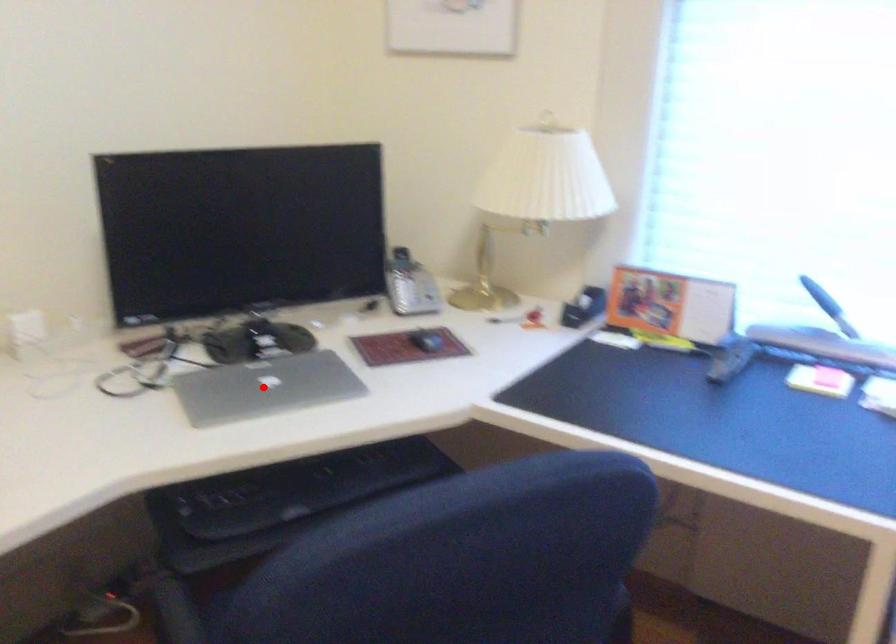
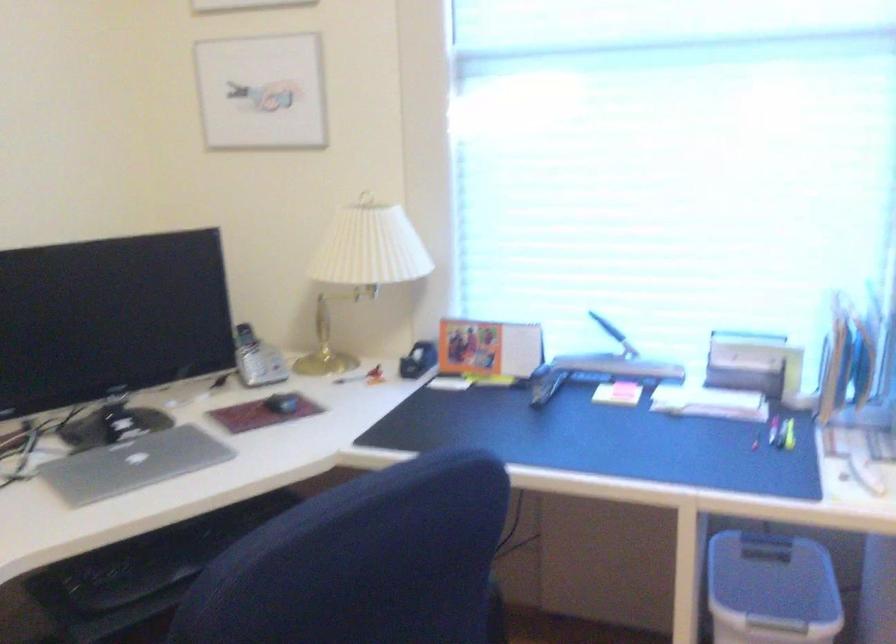
In the second image, find the point that corresponds to the highlighted location in the first image.

(133, 464)